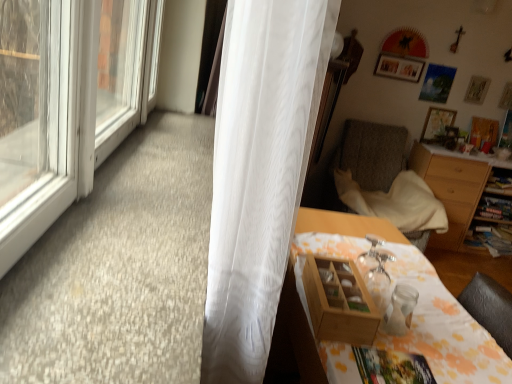
Question: Is point (412, 77) closer or farther from the camera than point (222, 379)?

Choices:
 (A) closer
 (B) farther

Answer: (B)

Question: From a real-world perspective, is wooden photo frame at upper center, acting as the 4th picture frame starting from the right, above or below white sheer curtain at left?

Choices:
 (A) below
 (B) above

Answer: (B)

Question: Which object is the farthest from the wooden picture frame at upper right, the fourth picture frame in the left-to-right sequence?

Choices:
 (A) wooden box at lower right
 (B) wooden desk at lower right
 (C) wooden photo frame at upper center, which is the first picture frame from left to right
 (D) wooden picture frame at upper right, placed as the second picture frame when sorted from right to left
 (E) wooden picture frame at upper right, which is counted as the 2th picture frame, starting from the left

Answer: (A)

Question: Which object is the closest to the wooden picture frame at upper right, the fourth picture frame in the left-to-right sequence?

Choices:
 (A) textured gray chair at right
 (B) wooden cabinet at right
 (C) wooden box at lower right
 (D) wooden picture frame at upper right, which is counted as the 2th picture frame, starting from the left
 (E) wooden photo frame at upper center, which is the first picture frame from left to right

Answer: (D)